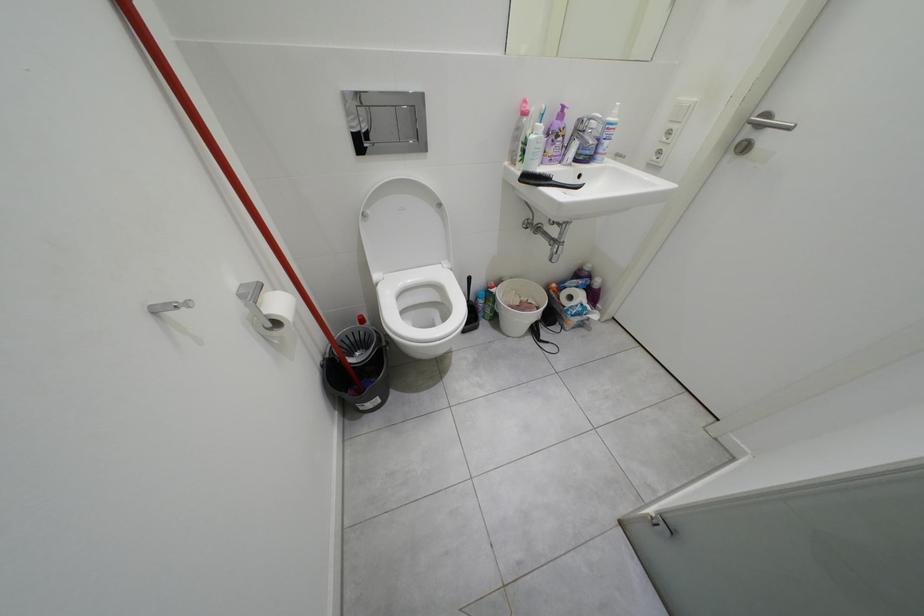
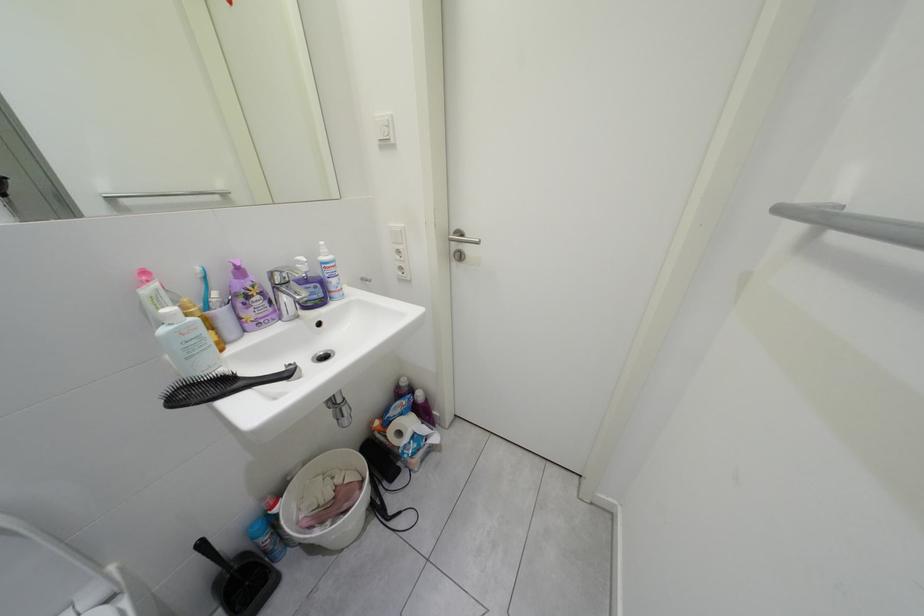
Question: The first image is from the beginning of the video and the second image is from the end. How did the camera likely rotate when shooting the video?

Choices:
 (A) Left
 (B) Right
 (C) Up
 (D) Down

Answer: (B)